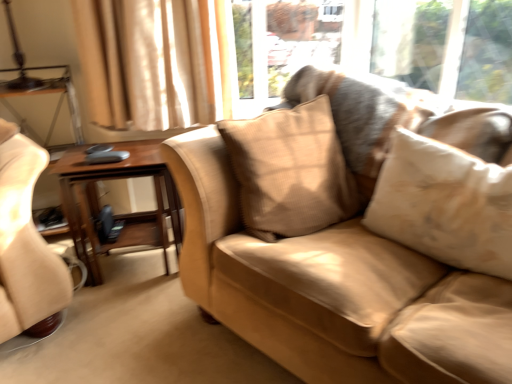
Find the location of a particular element. The height and width of the screenshot is (384, 512). beige textured pillow at center, the 1th pillow when ordered from left to right is located at coordinates (291, 171).

This screenshot has width=512, height=384. What do you see at coordinates (291, 171) in the screenshot? I see `beige textured pillow at center, the 1th pillow when ordered from left to right` at bounding box center [291, 171].

In order to click on suede-like beige couch at center in this screenshot , I will do 337,237.

Can you see beige textured pillow at center, the 1th pillow from the right, touching woodenmaterial/texturetable at left?

No.

Which object is positioned more to the left, beige textured pillow at center, the 1th pillow from the right, or woodenmaterial/texturetable at left?

From the viewer's perspective, woodenmaterial/texturetable at left appears more on the left side.

Consider the image. From a real-world perspective, which object stands above the other?

beige textured pillow at center, placed as the second pillow when sorted from left to right, is physically above.

What's the angular difference between beige textured pillow at center, placed as the second pillow when sorted from left to right, and woodenmaterial/texturetable at left's facing directions?

There is a 57.8-degree angle between the facing directions of beige textured pillow at center, placed as the second pillow when sorted from left to right, and woodenmaterial/texturetable at left.

Can you confirm if beige textured pillow at center, the 1th pillow when ordered from left to right, is taller than suede-like beige couch at center?

No, beige textured pillow at center, the 1th pillow when ordered from left to right, is not taller than suede-like beige couch at center.

Which is more to the left, beige textured pillow at center, the 1th pillow when ordered from left to right, or suede-like beige couch at center?

Positioned to the left is beige textured pillow at center, the 1th pillow when ordered from left to right.

Is beige textured pillow at center, the second pillow in the right-to-left sequence, positioned behind suede-like beige couch at center?

Yes, beige textured pillow at center, the second pillow in the right-to-left sequence, is further from the viewer.

How distant is woodenmaterial/texturetable at left from suede-like beige couch at center?

woodenmaterial/texturetable at left is 24.71 inches away from suede-like beige couch at center.

Is woodenmaterial/texturetable at left located outside suede-like beige couch at center?

Yes, woodenmaterial/texturetable at left is not within suede-like beige couch at center.

Consider the image. Could you tell me if woodenmaterial/texturetable at left is facing suede-like beige couch at center?

No, woodenmaterial/texturetable at left does not turn towards suede-like beige couch at center.

Is woodenmaterial/texturetable at left not near suede-like beige couch at center?

No, woodenmaterial/texturetable at left is in close proximity to suede-like beige couch at center.

Is suede-like beige couch at center in front of or behind woodenmaterial/texturetable at left in the image?

In the image, suede-like beige couch at center appears in front of woodenmaterial/texturetable at left.

From the image's perspective, is suede-like beige couch at center located above woodenmaterial/texturetable at left?

Yes, from the image's perspective, suede-like beige couch at center is above woodenmaterial/texturetable at left.

Does suede-like beige couch at center have a greater width compared to woodenmaterial/texturetable at left?

Correct, the width of suede-like beige couch at center exceeds that of woodenmaterial/texturetable at left.

The height and width of the screenshot is (384, 512). I want to click on studio couch in front of the woodenmaterial/texturetable at left, so click(337, 237).

In terms of height, does beige textured pillow at center, the second pillow in the right-to-left sequence, look taller or shorter compared to woodenmaterial/texturetable at left?

beige textured pillow at center, the second pillow in the right-to-left sequence, is shorter than woodenmaterial/texturetable at left.

From a real-world perspective, between beige textured pillow at center, the 1th pillow when ordered from left to right, and woodenmaterial/texturetable at left, who is vertically higher?

beige textured pillow at center, the 1th pillow when ordered from left to right, is physically above.

Is beige textured pillow at center, the second pillow in the right-to-left sequence, facing towards woodenmaterial/texturetable at left?

No, beige textured pillow at center, the second pillow in the right-to-left sequence, is not turned towards woodenmaterial/texturetable at left.

Which object is further away from the camera taking this photo, beige textured pillow at center, the second pillow in the right-to-left sequence, or woodenmaterial/texturetable at left?

woodenmaterial/texturetable at left is more distant.

Is beige textured pillow at center, the 1th pillow when ordered from left to right, shorter than beige textured pillow at center, placed as the second pillow when sorted from left to right?

No.

From the image's perspective, which is above, beige textured pillow at center, the second pillow in the right-to-left sequence, or beige textured pillow at center, the 1th pillow from the right?

beige textured pillow at center, the second pillow in the right-to-left sequence, appears higher in the image.

You are a GUI agent. You are given a task and a screenshot of the screen. Output one action in this format:
    pyautogui.click(x=<x>, y=<y>)
    Task: Click on the pillow that appears below the beige textured pillow at center, the 1th pillow when ordered from left to right (from a real-world perspective)
    The image size is (512, 384).
    Given the screenshot: What is the action you would take?
    pyautogui.click(x=444, y=204)

Between beige textured pillow at center, the 1th pillow when ordered from left to right, and beige textured pillow at center, the 1th pillow from the right, which one appears on the right side from the viewer's perspective?

beige textured pillow at center, the 1th pillow from the right.

Who is smaller, beige textured pillow at center, placed as the second pillow when sorted from left to right, or suede-like beige couch at center?

beige textured pillow at center, placed as the second pillow when sorted from left to right, is smaller.

Are beige textured pillow at center, placed as the second pillow when sorted from left to right, and suede-like beige couch at center beside each other?

No, beige textured pillow at center, placed as the second pillow when sorted from left to right, is not in contact with suede-like beige couch at center.

From the image's perspective, between beige textured pillow at center, the 1th pillow from the right, and suede-like beige couch at center, who is located below?

suede-like beige couch at center appears lower in the image.

Could you tell me if beige textured pillow at center, the 1th pillow from the right, is facing suede-like beige couch at center?

Yes, beige textured pillow at center, the 1th pillow from the right, is oriented towards suede-like beige couch at center.

The width and height of the screenshot is (512, 384). I want to click on table on the left of beige textured pillow at center, placed as the second pillow when sorted from left to right, so click(120, 214).

Locate an element on the screen. The image size is (512, 384). studio couch located on the right of beige textured pillow at center, the second pillow in the right-to-left sequence is located at coordinates (337, 237).

Considering their positions, is beige textured pillow at center, the second pillow in the right-to-left sequence, positioned further to woodenmaterial/texturetable at left than beige textured pillow at center, placed as the second pillow when sorted from left to right?

beige textured pillow at center, placed as the second pillow when sorted from left to right, is further to woodenmaterial/texturetable at left.

From the image, which object appears to be farther from beige textured pillow at center, placed as the second pillow when sorted from left to right, woodenmaterial/texturetable at left or suede-like beige couch at center?

woodenmaterial/texturetable at left is positioned further to the anchor beige textured pillow at center, placed as the second pillow when sorted from left to right.

Consider the image. When comparing their distances from suede-like beige couch at center, does woodenmaterial/texturetable at left or beige textured pillow at center, the 1th pillow when ordered from left to right, seem closer?

beige textured pillow at center, the 1th pillow when ordered from left to right, lies closer to suede-like beige couch at center than the other object.

Which object lies further to the anchor point suede-like beige couch at center, beige textured pillow at center, the second pillow in the right-to-left sequence, or beige textured pillow at center, the 1th pillow from the right?

beige textured pillow at center, the 1th pillow from the right, is positioned further to the anchor suede-like beige couch at center.

Estimate the real-world distances between objects in this image. Which object is closer to beige textured pillow at center, the 1th pillow from the right, suede-like beige couch at center or beige textured pillow at center, the second pillow in the right-to-left sequence?

suede-like beige couch at center is positioned closer to the anchor beige textured pillow at center, the 1th pillow from the right.

Considering their positions, is woodenmaterial/texturetable at left positioned closer to beige textured pillow at center, placed as the second pillow when sorted from left to right, than beige textured pillow at center, the 1th pillow when ordered from left to right?

Based on the image, beige textured pillow at center, the 1th pillow when ordered from left to right, appears to be nearer to beige textured pillow at center, placed as the second pillow when sorted from left to right.

From the image, which object appears to be farther from beige textured pillow at center, the 1th pillow when ordered from left to right, suede-like beige couch at center or woodenmaterial/texturetable at left?

Among the two, woodenmaterial/texturetable at left is located further to beige textured pillow at center, the 1th pillow when ordered from left to right.

Estimate the real-world distances between objects in this image. Which object is closer to beige textured pillow at center, the 1th pillow when ordered from left to right, beige textured pillow at center, placed as the second pillow when sorted from left to right, or woodenmaterial/texturetable at left?

beige textured pillow at center, placed as the second pillow when sorted from left to right, is closer to beige textured pillow at center, the 1th pillow when ordered from left to right.

Locate an element on the screen. This screenshot has width=512, height=384. pillow between woodenmaterial/texturetable at left and beige textured pillow at center, placed as the second pillow when sorted from left to right, from left to right is located at coordinates pyautogui.click(x=291, y=171).

At what (x,y) coordinates should I click in order to perform the action: click on studio couch between woodenmaterial/texturetable at left and beige textured pillow at center, the 1th pillow from the right, in the horizontal direction. Please return your answer as a coordinate pair (x, y). This screenshot has height=384, width=512. Looking at the image, I should click on (337, 237).

In order to click on pillow located between suede-like beige couch at center and beige textured pillow at center, the 1th pillow when ordered from left to right, in the depth direction in this screenshot , I will do `click(444, 204)`.